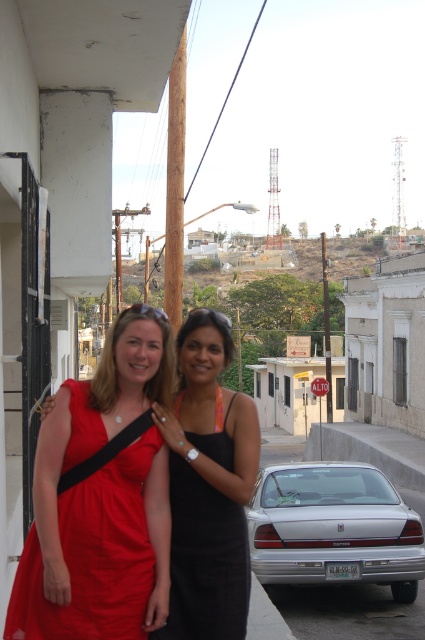
Question: Which object is farther from the camera taking this photo?

Choices:
 (A) silver metallic sedan at lower center
 (B) matte red dress at center
 (C) matte red dress at left

Answer: (A)

Question: Which object is farther from the camera taking this photo?

Choices:
 (A) matte red dress at left
 (B) black satin dress at center
 (C) silver metallic sedan at lower center
 (D) matte red dress at center

Answer: (C)

Question: Does matte red dress at left have a lesser width compared to silver metallic sedan at lower center?

Choices:
 (A) no
 (B) yes

Answer: (B)

Question: Is matte red dress at center positioned at the back of black satin dress at center?

Choices:
 (A) yes
 (B) no

Answer: (A)

Question: Is matte red dress at center closer to the viewer compared to black satin dress at center?

Choices:
 (A) no
 (B) yes

Answer: (A)

Question: Which point appears farthest from the camera in this image?

Choices:
 (A) (175, 515)
 (B) (141, 561)
 (C) (268, 486)
 (D) (187, 637)

Answer: (C)